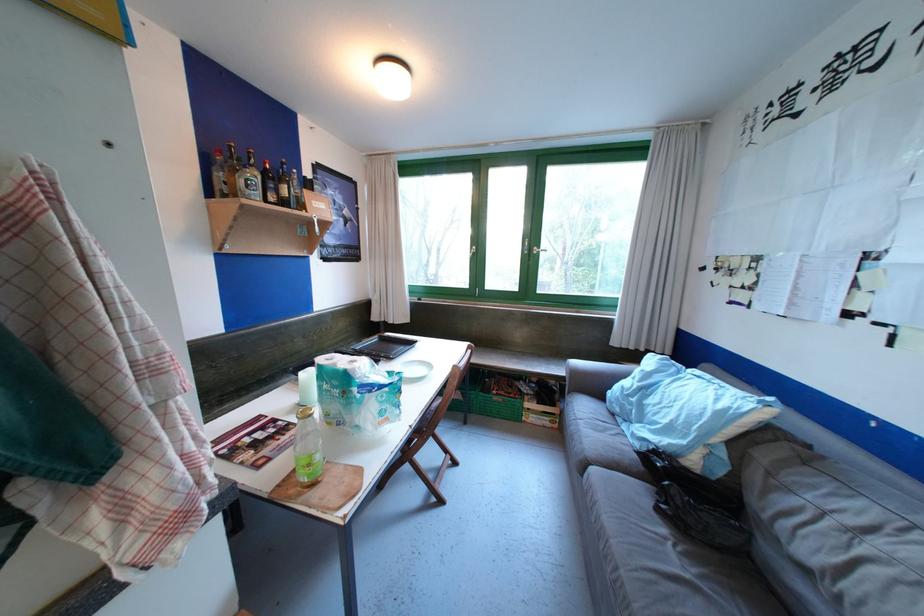
Locate an element on the screen. The width and height of the screenshot is (924, 616). pack of paper towels is located at coordinates (357, 392).